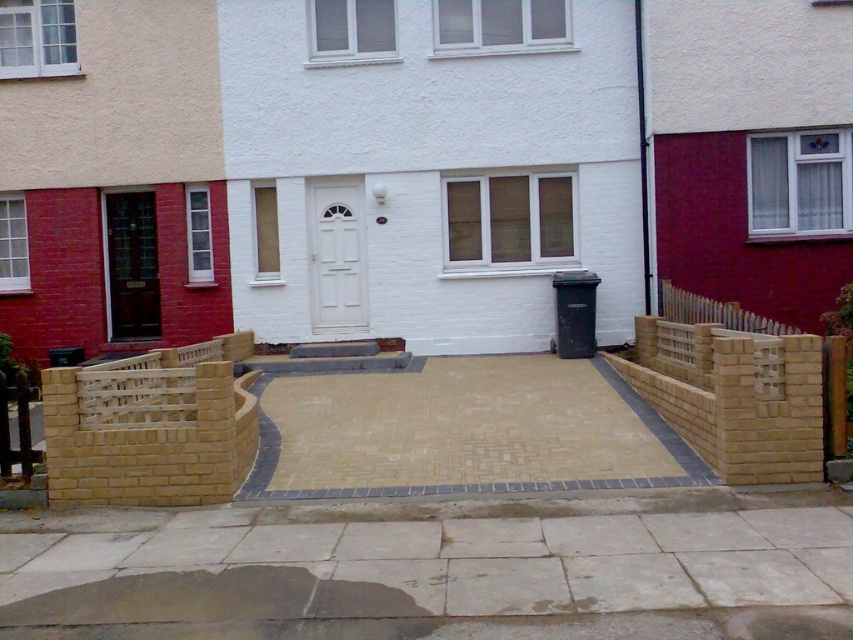
Which is more to the right, smooth concrete pavement at center or matte black door at left?

Positioned to the right is smooth concrete pavement at center.

The image size is (853, 640). What do you see at coordinates (436, 570) in the screenshot?
I see `smooth concrete pavement at center` at bounding box center [436, 570].

This screenshot has width=853, height=640. I want to click on smooth concrete pavement at center, so tap(436, 570).

Who is higher up, smooth concrete pavement at center or tan paving stones at center?

Positioned higher is tan paving stones at center.

Is point (711, 598) positioned in front of point (413, 449)?

Yes, point (711, 598) is in front of point (413, 449).

What do you see at coordinates (436, 570) in the screenshot? I see `smooth concrete pavement at center` at bounding box center [436, 570].

You are a GUI agent. You are given a task and a screenshot of the screen. Output one action in this format:
    pyautogui.click(x=<x>, y=<y>)
    Task: Click on the smooth concrete pavement at center
    
    Given the screenshot: What is the action you would take?
    pyautogui.click(x=436, y=570)

Is point (469, 605) positioned after point (316, 284)?

That is False.

Which is in front, point (599, 524) or point (312, 214)?

Point (599, 524) is in front.

The image size is (853, 640). What are the coordinates of `smooth concrete pavement at center` in the screenshot? It's located at (436, 570).